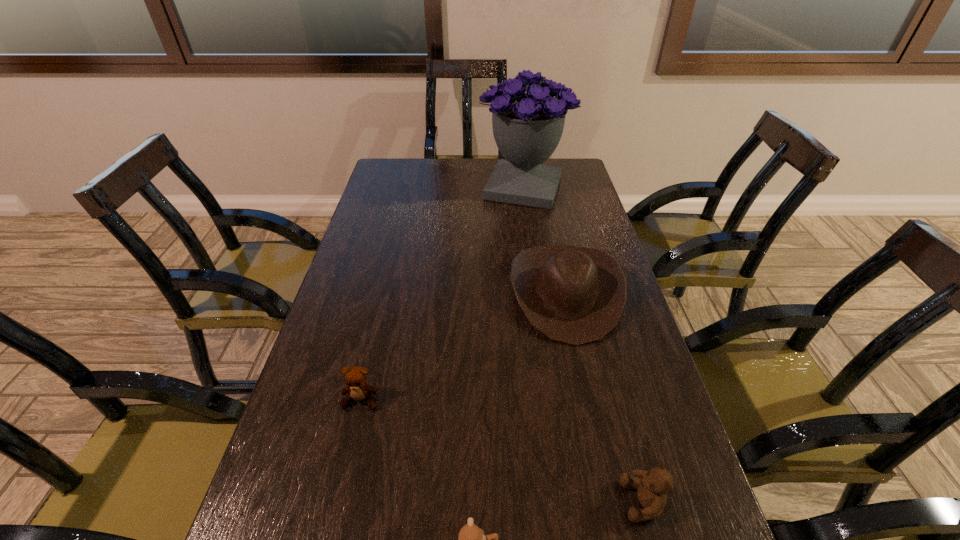
The height and width of the screenshot is (540, 960). What are the coordinates of `empty space between the farthest teddy bear and the cowboy hat` in the screenshot? It's located at (463, 347).

Where is `the fourth closest object to the second teddy bear from left to right`? This screenshot has height=540, width=960. the fourth closest object to the second teddy bear from left to right is located at coordinates (527, 127).

This screenshot has width=960, height=540. In order to click on object that is the closest to the leftmost object in this screenshot , I will do `click(471, 539)`.

Choose which teddy bear is the nearest neighbor to the cowboy hat. Please provide its 2D coordinates. Your answer should be formatted as a tuple, i.e. [(x, y)], where the tuple contains the x and y coordinates of a point satisfying the conditions above.

[(356, 377)]

The width and height of the screenshot is (960, 540). Find the location of `teddy bear object that ranks as the second closest to the bouquet`. teddy bear object that ranks as the second closest to the bouquet is located at coordinates (652, 486).

This screenshot has width=960, height=540. I want to click on free space that satisfies the following two spatial constraints: 1. on the front side of the second farthest object; 2. on the right side of the bouquet, so click(x=539, y=294).